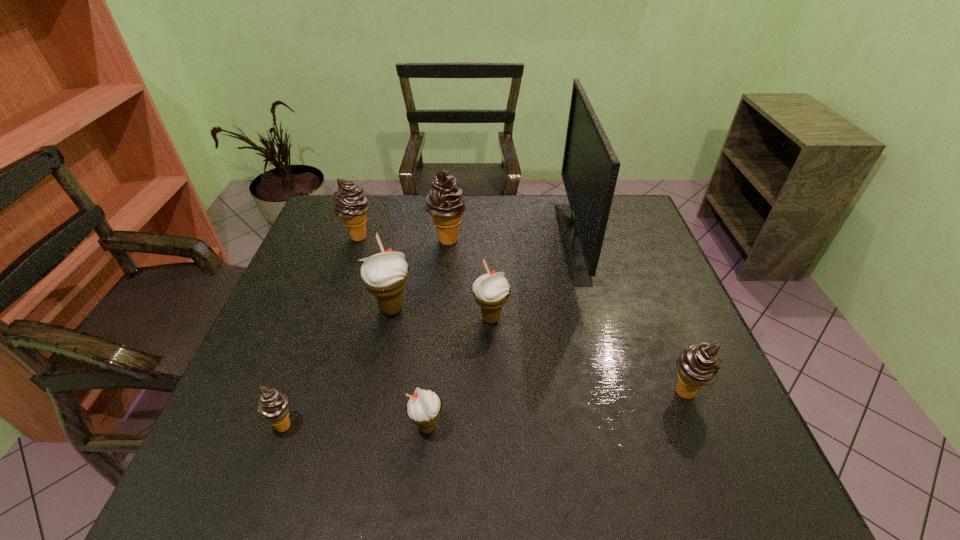
Locate an element on the screen. This screenshot has height=540, width=960. the third closest white icecream to the smallest chocolate icecream is located at coordinates (x=491, y=291).